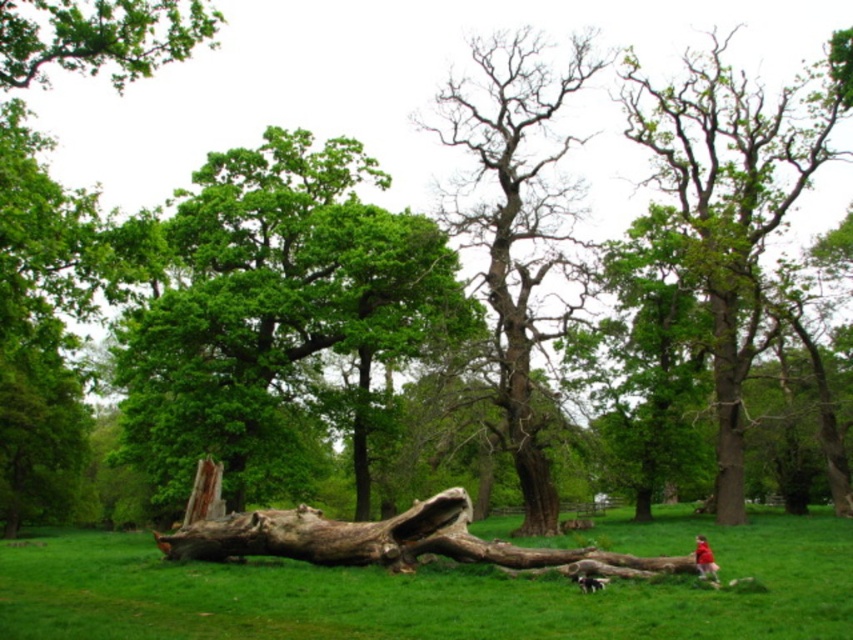
Question: Is smooth bark log at center thinner than brown rough wood log at center?

Choices:
 (A) yes
 (B) no

Answer: (B)

Question: Considering the relative positions of smooth bark log at center and bare wood tree at center in the image provided, where is smooth bark log at center located with respect to bare wood tree at center?

Choices:
 (A) left
 (B) right

Answer: (A)

Question: Which object is positioned closest to the green rough bark tree at upper right?

Choices:
 (A) bare wood tree at center
 (B) brown rough wood log at center
 (C) green leafy branch at upper left

Answer: (A)

Question: Which of the following is the farthest from the observer?

Choices:
 (A) smooth bark log at center
 (B) green leafy branch at upper left
 (C) brown rough wood log at center

Answer: (B)

Question: Does green leafy tree at center come behind smooth bark log at center?

Choices:
 (A) no
 (B) yes

Answer: (B)

Question: Which point is closer to the camera?

Choices:
 (A) (345, 547)
 (B) (666, 113)
 (C) (270, 365)

Answer: (A)